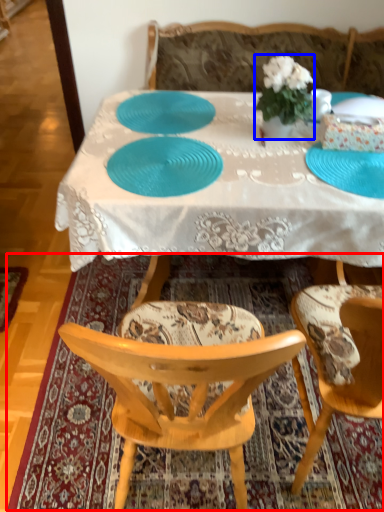
Question: Which point is further to the camera, mat (highlighted by a red box) or houseplant (highlighted by a blue box)?

Choices:
 (A) mat
 (B) houseplant

Answer: (B)